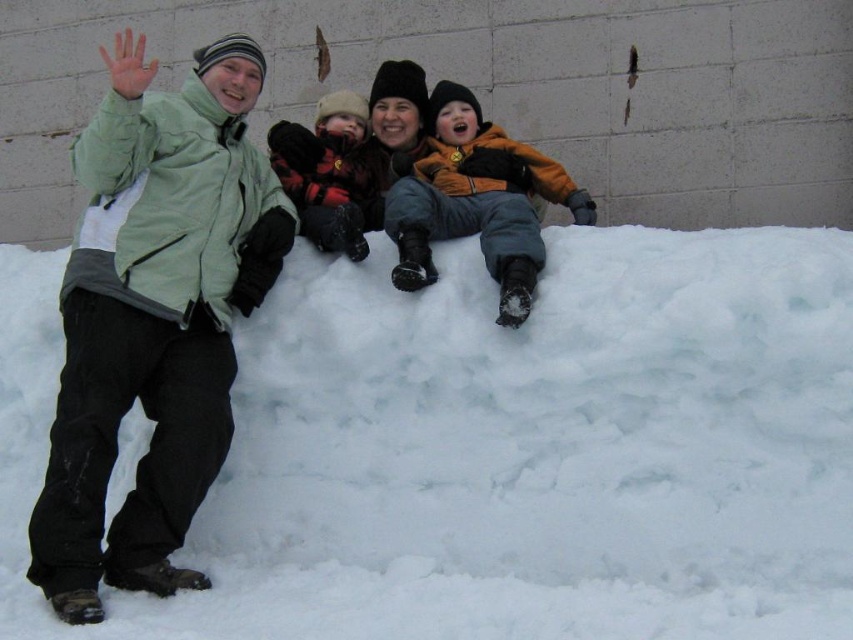
Question: Which object is positioned farthest from the flannel shirt at center?

Choices:
 (A) green matte jacket at left
 (B) white fluffy snow at lower center
 (C) orange fleece jacket at center

Answer: (B)

Question: Considering the real-world distances, which object is farthest from the flannel shirt at center?

Choices:
 (A) green matte jacket at left
 (B) white fluffy snow at lower center

Answer: (B)

Question: Does green matte jacket at left come in front of orange fleece jacket at center?

Choices:
 (A) yes
 (B) no

Answer: (A)

Question: Which of these objects is positioned farthest from the green matte jacket at left?

Choices:
 (A) flannel shirt at center
 (B) white fluffy snow at lower center

Answer: (B)

Question: Can you confirm if white fluffy snow at lower center is smaller than orange fleece jacket at center?

Choices:
 (A) no
 (B) yes

Answer: (B)

Question: Is the position of orange fleece jacket at center less distant than that of flannel shirt at center?

Choices:
 (A) no
 (B) yes

Answer: (B)